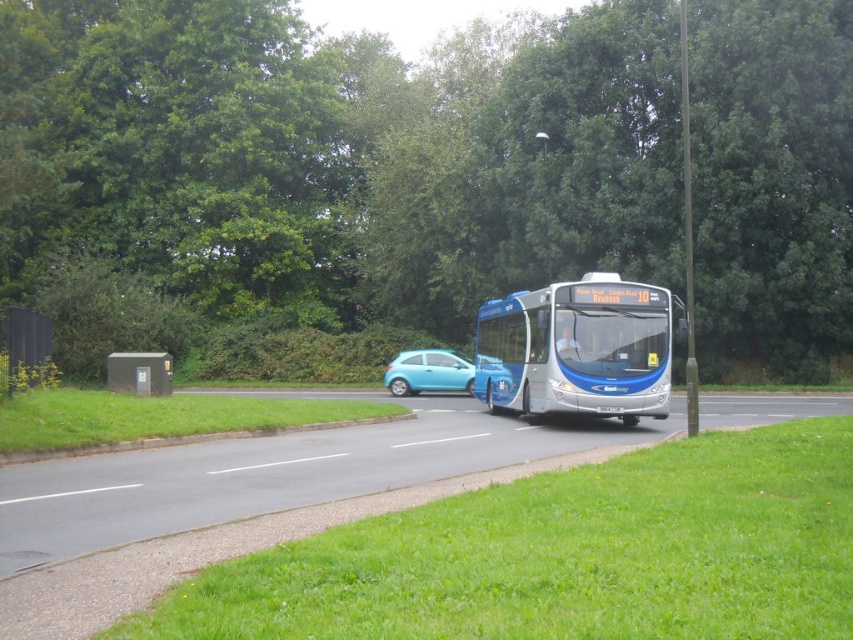
Question: Can you confirm if light blue glossy hatchback at center is positioned to the left of metallic gray bus stop at lower left?

Choices:
 (A) yes
 (B) no

Answer: (B)

Question: Estimate the real-world distances between objects in this image. Which object is farther from the metallic gray bus stop at lower left?

Choices:
 (A) blue metallic bus at center
 (B) light blue glossy hatchback at center

Answer: (B)

Question: Which point is closer to the camera taking this photo?

Choices:
 (A) (618, 296)
 (B) (165, 374)

Answer: (A)

Question: Is blue metallic bus at center bigger than light blue glossy hatchback at center?

Choices:
 (A) no
 (B) yes

Answer: (B)

Question: Can you confirm if blue metallic bus at center is smaller than metallic gray bus stop at lower left?

Choices:
 (A) yes
 (B) no

Answer: (A)

Question: Considering the real-world distances, which object is closest to the light blue glossy hatchback at center?

Choices:
 (A) metallic gray bus stop at lower left
 (B) blue metallic bus at center

Answer: (B)